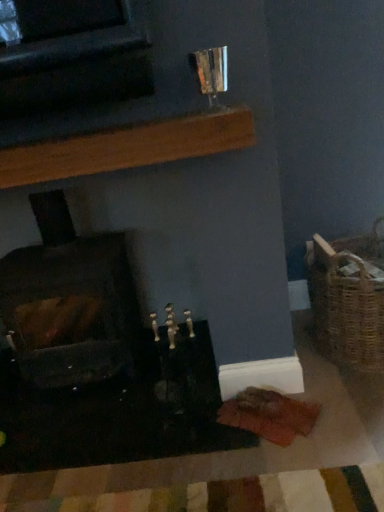
Question: Is wooden plank at upper center in front of or behind woven brown basket at right in the image?

Choices:
 (A) front
 (B) behind

Answer: (A)

Question: Does point (62, 152) appear closer or farther from the camera than point (339, 312)?

Choices:
 (A) farther
 (B) closer

Answer: (B)

Question: Estimate the real-world distances between objects in this image. Which object is closer to the wooden plank at upper center?

Choices:
 (A) woven brown basket at right
 (B) dark brown wood at left

Answer: (B)

Question: Which object is positioned farthest from the wooden plank at upper center?

Choices:
 (A) woven brown basket at right
 (B) dark brown wood at left

Answer: (A)